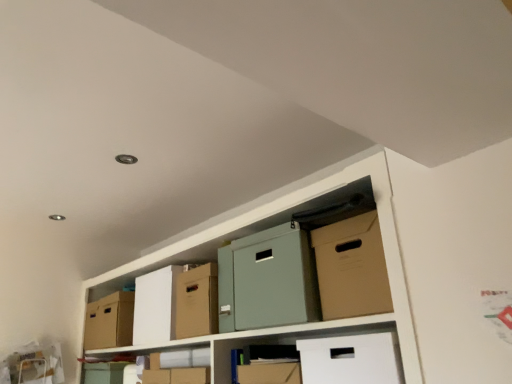
Question: Are matte cardboard box at center and cardboard box at center, placed as the second cardboard box when sorted from front to back, located far from each other?

Choices:
 (A) no
 (B) yes

Answer: (A)

Question: From the image's perspective, does matte cardboard box at center appear higher than cardboard box at center, which is the 2th cardboard box from back to front?

Choices:
 (A) yes
 (B) no

Answer: (A)

Question: Is matte cardboard box at center behind cardboard box at center, the 2th cardboard box when ordered from left to right?

Choices:
 (A) no
 (B) yes

Answer: (A)

Question: Is matte cardboard box at center outside cardboard box at center, marked as the second cardboard box in a right-to-left arrangement?

Choices:
 (A) yes
 (B) no

Answer: (A)

Question: Is matte cardboard box at center surrounding cardboard box at center, the 2th cardboard box when ordered from left to right?

Choices:
 (A) yes
 (B) no

Answer: (B)

Question: Could you tell me if matte cardboard box at center is facing cardboard box at center, the 2th cardboard box when ordered from left to right?

Choices:
 (A) yes
 (B) no

Answer: (B)

Question: Does cardboard box at left, placed as the 3th cardboard box when sorted from front to back, appear on the left side of cardboard box at center, marked as the second cardboard box in a right-to-left arrangement?

Choices:
 (A) no
 (B) yes

Answer: (B)

Question: Is cardboard box at left, placed as the 3th cardboard box when sorted from front to back, turned away from cardboard box at center, marked as the second cardboard box in a right-to-left arrangement?

Choices:
 (A) yes
 (B) no

Answer: (B)

Question: From a real-world perspective, is cardboard box at left, marked as the 3th cardboard box in a right-to-left arrangement, located beneath cardboard box at center, the 2th cardboard box when ordered from left to right?

Choices:
 (A) no
 (B) yes

Answer: (B)

Question: Does cardboard box at left, arranged as the 1th cardboard box when viewed from the left, have a greater width compared to cardboard box at center, the 2th cardboard box when ordered from left to right?

Choices:
 (A) no
 (B) yes

Answer: (A)

Question: Is cardboard box at left, placed as the 3th cardboard box when sorted from front to back, closer to the viewer compared to cardboard box at center, marked as the second cardboard box in a right-to-left arrangement?

Choices:
 (A) no
 (B) yes

Answer: (A)

Question: Does cardboard box at center, placed as the second cardboard box when sorted from front to back, have a smaller size compared to cardboard box at left, arranged as the 1th cardboard box when viewed from the left?

Choices:
 (A) no
 (B) yes

Answer: (A)